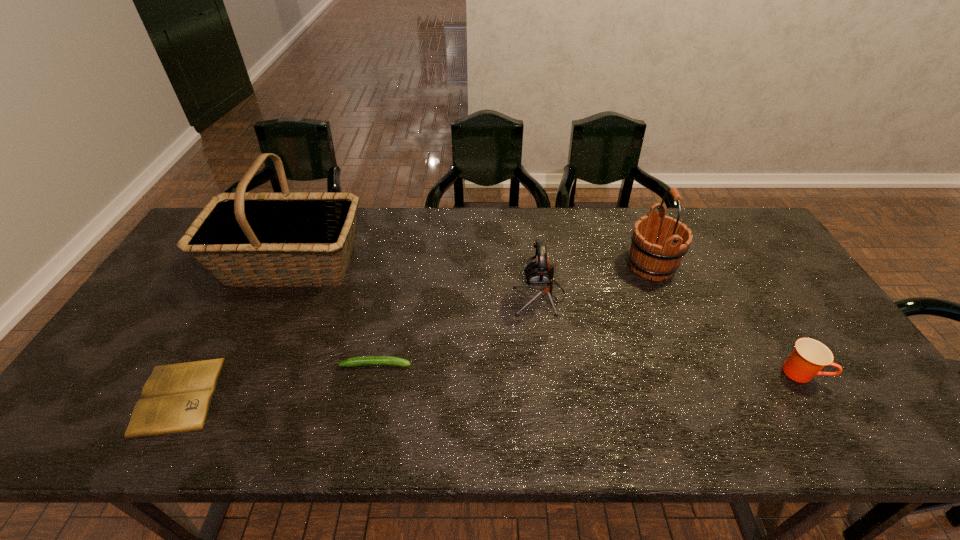
Locate an element on the screen. Image resolution: width=960 pixels, height=540 pixels. book located at the left edge is located at coordinates tap(176, 398).

You are a GUI agent. You are given a task and a screenshot of the screen. Output one action in this format:
    pyautogui.click(x=<x>, y=<y>)
    Task: Click on the object positioned at the right edge
    The image size is (960, 540).
    Given the screenshot: What is the action you would take?
    pyautogui.click(x=809, y=356)

I want to click on object situated at the far left corner, so pos(225,239).

Identify the location of object located at the near left corner. Image resolution: width=960 pixels, height=540 pixels. (176, 398).

In the image, there is a desktop. Identify the location of vacant space at the far edge. The image size is (960, 540). (635, 210).

Where is `vacant space at the near edge of the desktop`? vacant space at the near edge of the desktop is located at coordinates (244, 420).

What are the coordinates of `vacant space at the left edge` in the screenshot? It's located at coord(129,403).

Identify the location of free spot at the right edge of the desktop. 832,382.

This screenshot has height=540, width=960. I want to click on vacant space at the near left corner of the desktop, so click(96, 417).

Locate an element on the screen. The height and width of the screenshot is (540, 960). empty location between the tallest object and the shortest object is located at coordinates (234, 329).